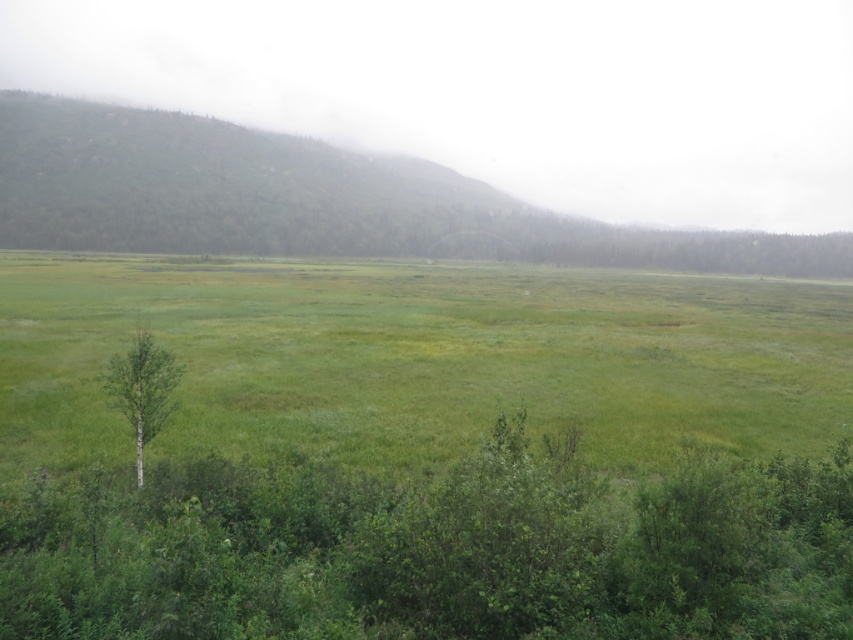
Question: Which of the following is the farthest from the observer?

Choices:
 (A) green matte tree at left
 (B) green leafy tree at lower left

Answer: (A)

Question: Among these points, which one is nearest to the camera?

Choices:
 (A) (173, 404)
 (B) (354, 502)

Answer: (B)

Question: Can you confirm if green leafy tree at lower left is positioned above green matte tree at left?

Choices:
 (A) no
 (B) yes

Answer: (A)

Question: Considering the relative positions of green leafy tree at lower left and green matte tree at left in the image provided, where is green leafy tree at lower left located with respect to green matte tree at left?

Choices:
 (A) below
 (B) above

Answer: (A)

Question: From the image, what is the correct spatial relationship of green leafy tree at lower left in relation to green matte tree at left?

Choices:
 (A) below
 (B) above

Answer: (A)